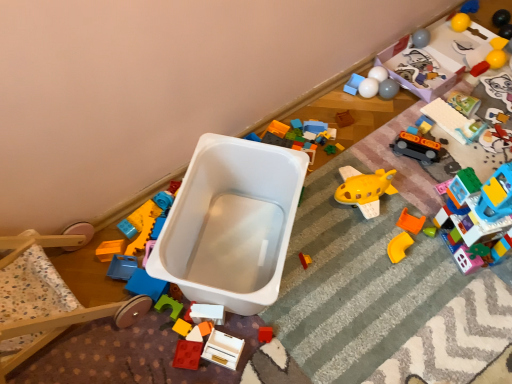
At what (x,y) coordinates should I click in order to perform the action: click on free space between matte yellow toy airplane at center, placed as the 12th toy when sorted from right to left, and orange plastic block at lower right, placed as the 10th toy when sorted from left to right. Please return your answer as a coordinate pair (x, y). Looking at the image, I should click on (358, 243).